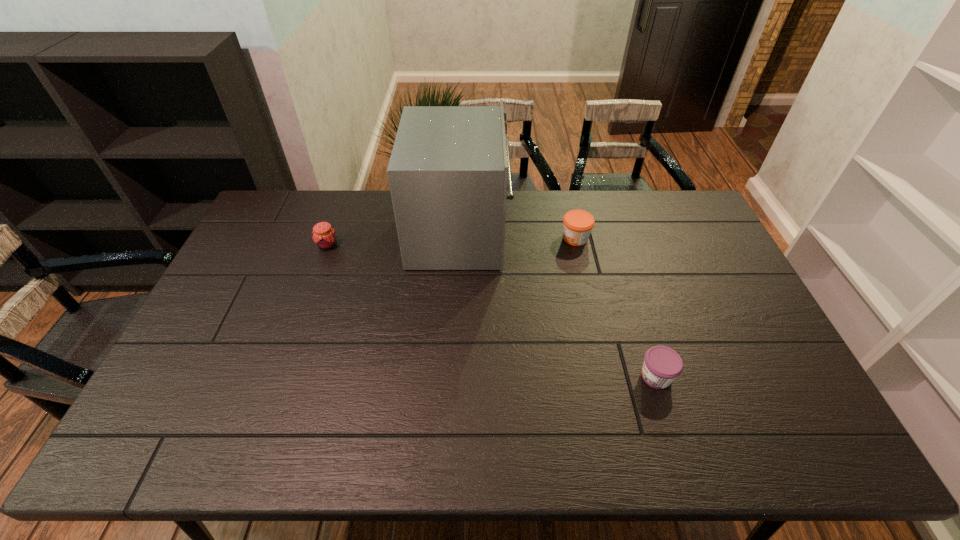
Where is `toaster oven`? This screenshot has height=540, width=960. toaster oven is located at coordinates (448, 170).

Locate an element on the screen. the tallest object is located at coordinates (448, 170).

You are a GUI agent. You are given a task and a screenshot of the screen. Output one action in this format:
    pyautogui.click(x=<x>, y=<y>)
    Task: Click on the second jam from right to left
    The height and width of the screenshot is (540, 960).
    Given the screenshot: What is the action you would take?
    pyautogui.click(x=577, y=224)

The image size is (960, 540). What are the coordinates of `the leftmost jam` in the screenshot? It's located at (324, 236).

Where is `the rightmost object`? the rightmost object is located at coordinates click(662, 365).

I want to click on the rightmost jam, so click(x=662, y=365).

Where is `vacant space situated 0.210m on the front panel of the third object from right to left`? The width and height of the screenshot is (960, 540). vacant space situated 0.210m on the front panel of the third object from right to left is located at coordinates (567, 233).

Where is `free point located on the front label of the third object from left to right`? This screenshot has width=960, height=540. free point located on the front label of the third object from left to right is located at coordinates (459, 238).

Where is `vacant space located 0.050m on the front label of the third object from left to right`? The width and height of the screenshot is (960, 540). vacant space located 0.050m on the front label of the third object from left to right is located at coordinates (546, 238).

Find the location of `free space located 0.350m on the front label of the third object from left to right`. free space located 0.350m on the front label of the third object from left to right is located at coordinates (459, 238).